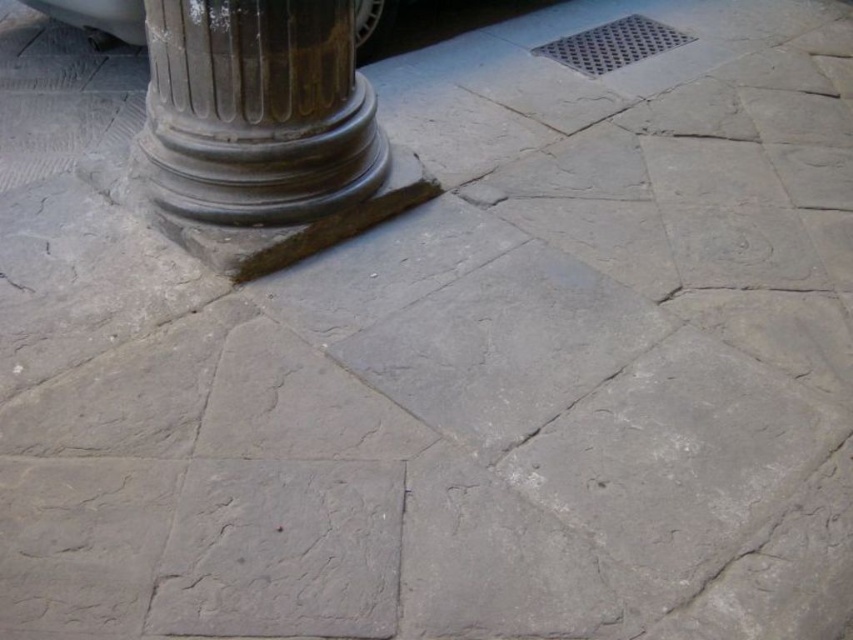
You are a delivery person with a cart that is 1.5 meters wide. You need to move from the gray stone column at left to the shiny silver car at upper left. Can your cart fit through the space between them?

The distance between the gray stone column at left and the shiny silver car at upper left is 1.40 meters. Since your cart is 1.5 meters wide, it cannot fit through the space between them.

You are a pedestrian standing on the stone paving and see the gray stone column at left and the shiny silver car at upper left. Which object is positioned lower in the image?

The gray stone column at left is located below the shiny silver car at upper left, so the gray stone column at left is positioned lower in the image.

You are standing in a courtyard and see the gray stone column at left and the shiny silver car at upper left. Which object is located to the left of the other?

The gray stone column at left is positioned on the left side of shiny silver car at upper left, so the gray stone column at left is to the left of the shiny silver car at upper left.